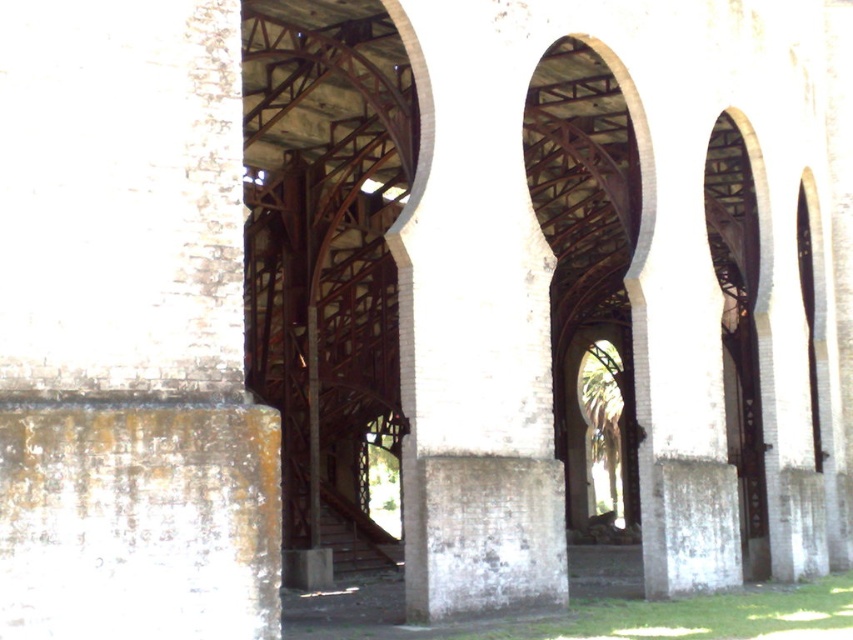
What do you see at coordinates (556, 275) in the screenshot? I see `rusty metal bridge at center` at bounding box center [556, 275].

Is rusty metal bridge at center below white brick pillar at center?

Actually, rusty metal bridge at center is above white brick pillar at center.

Which is behind, point (643, 476) or point (477, 289)?

The point (643, 476) is behind.

Locate an element on the screen. This screenshot has width=853, height=640. rusty metal bridge at center is located at coordinates (556, 275).